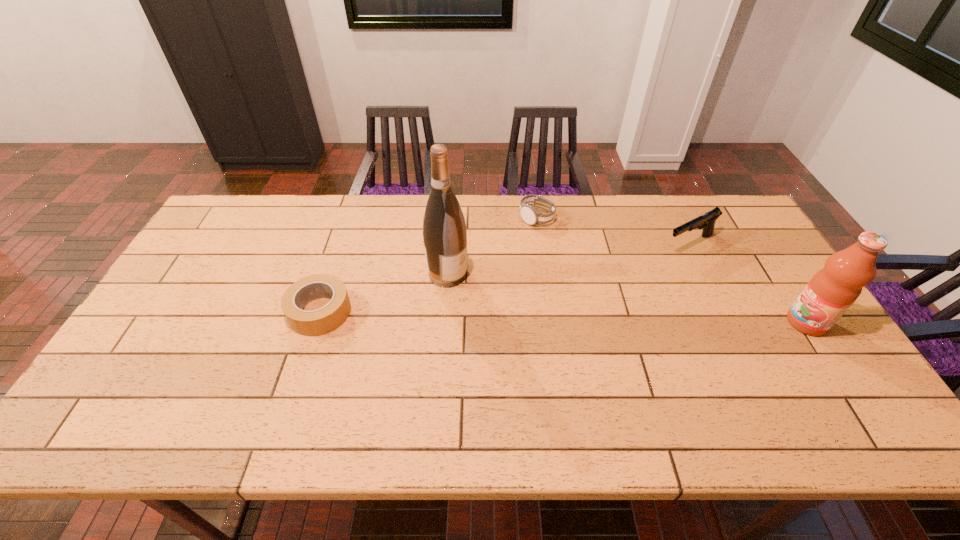
Locate an element on the screen. The height and width of the screenshot is (540, 960). the leftmost object is located at coordinates (317, 322).

Where is `the shortest object`? the shortest object is located at coordinates (317, 322).

Locate an element on the screen. The width and height of the screenshot is (960, 540). fruit juice is located at coordinates (832, 290).

Find the location of `the rightmost object`. the rightmost object is located at coordinates (832, 290).

Locate an element on the screen. the third nearest object is located at coordinates (444, 229).

The width and height of the screenshot is (960, 540). In order to click on the fourth object from right to left in this screenshot , I will do `click(444, 229)`.

Locate an element on the screen. the third object from left to right is located at coordinates (530, 215).

You are a GUI agent. You are given a task and a screenshot of the screen. Output one action in this format:
    pyautogui.click(x=<x>, y=<y>)
    Task: Click on the watch
    This screenshot has width=960, height=540.
    Given the screenshot: What is the action you would take?
    pyautogui.click(x=530, y=215)

The height and width of the screenshot is (540, 960). What are the coordinates of `the fourth nearest object` in the screenshot? It's located at (707, 221).

I want to click on the third shortest object, so click(707, 221).